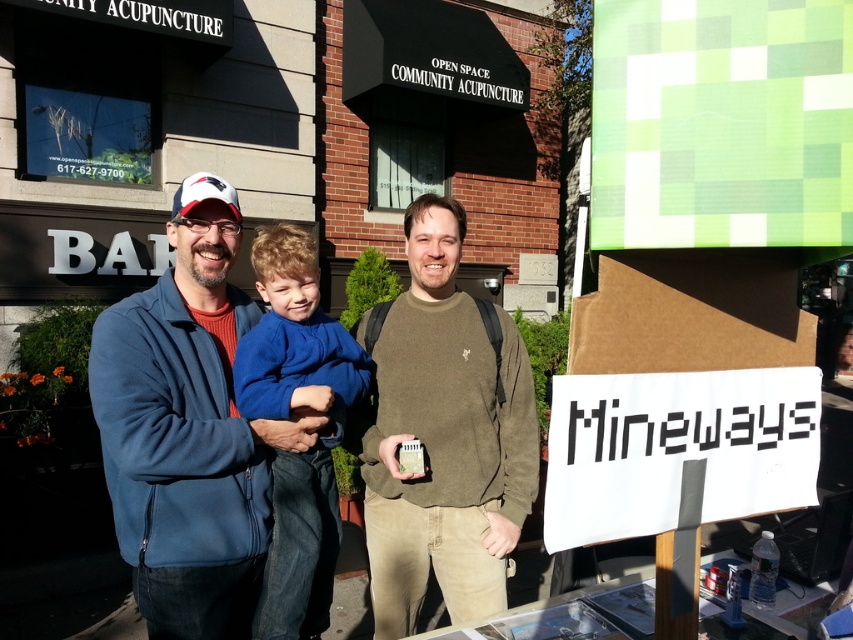
You are a photographer taking a picture of the blue fleece jacket at left and the green matte sweater at center. Which object should you focus on first if you want to capture both clearly in the same frame?

The blue fleece jacket at left is located above the green matte sweater at center, so focusing on the blue fleece jacket at left first will ensure both are in focus as they are aligned vertically.

You are a photographer trying to capture a candid shot of the blue fleece jacket at left and the matte white baseball cap at upper left. Since you want to include both in the frame, which object should you position closer to the center of your camera viewfinder to ensure both are visible?

The blue fleece jacket at left is to the right of the matte white baseball cap at upper left, so positioning the matte white baseball cap at upper left closer to the center would help include both in the frame since it is positioned to the left of the jacket.